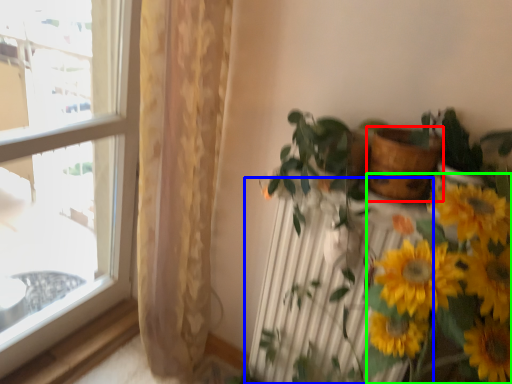
Question: Which is nearer to the flowerpot (highlighted by a red box)? radiator (highlighted by a blue box) or floral arrangement (highlighted by a green box).

Choices:
 (A) radiator
 (B) floral arrangement

Answer: (B)